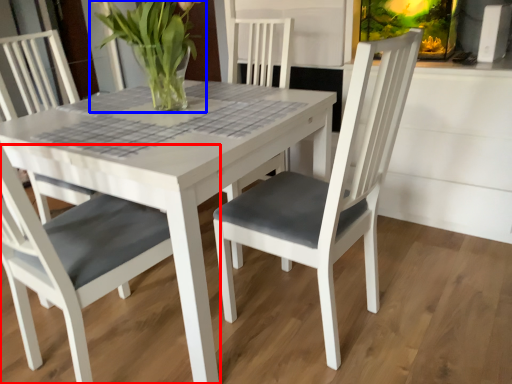
Question: Which of the following is the farthest to the observer, chair (highlighted by a red box) or houseplant (highlighted by a blue box)?

Choices:
 (A) chair
 (B) houseplant

Answer: (B)